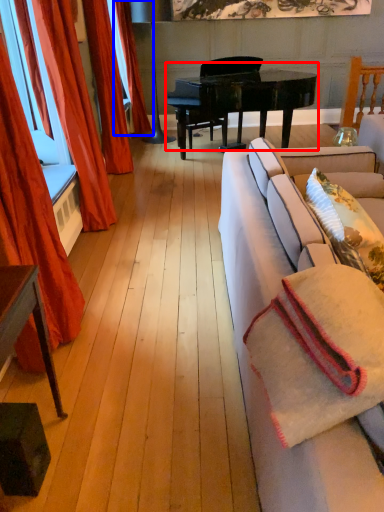
Question: Which object appears farthest to the camera in this image, piano (highlighted by a red box) or curtain (highlighted by a blue box)?

Choices:
 (A) piano
 (B) curtain

Answer: (B)